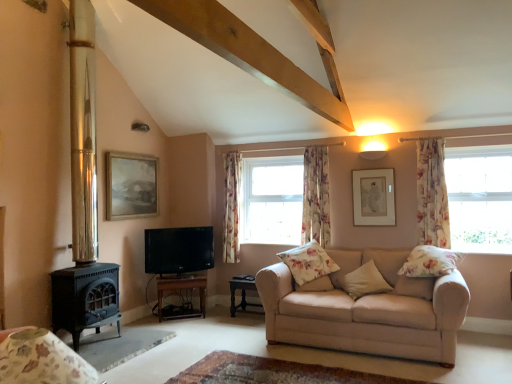
Locate an element on the screen. free space above floral fabric pillow at center, acting as the second pillow starting from the left (from a real-world perspective) is located at coordinates (313, 274).